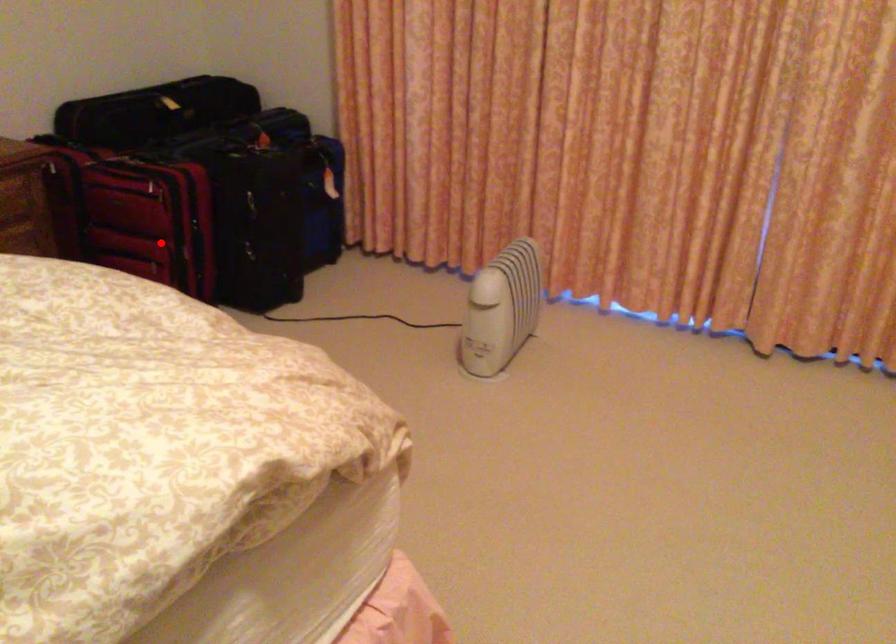
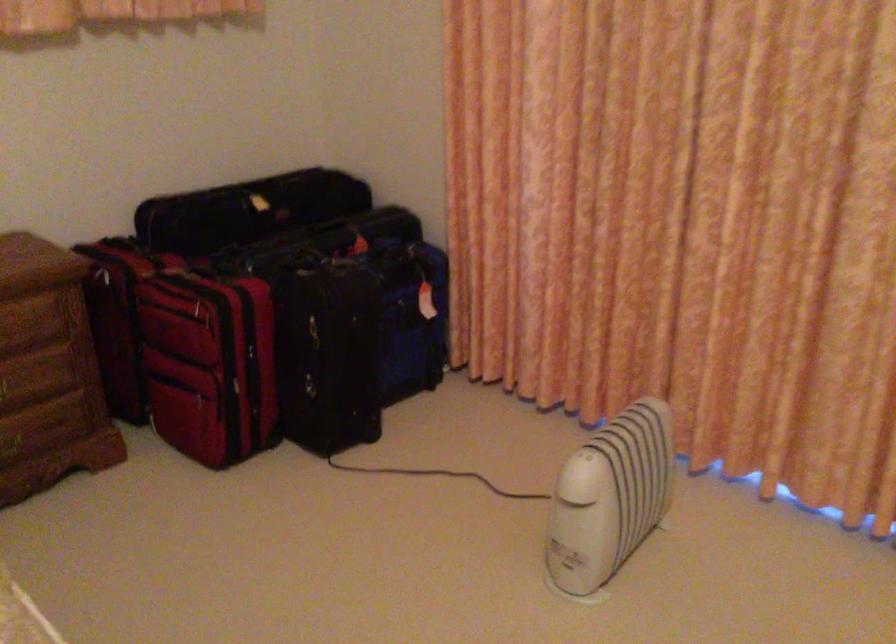
Question: I am providing you with two images of the same scene from different viewpoints. A red point is shown in image1. For the corresponding object point in image2, is it positioned nearer or farther from the camera?

Choices:
 (A) Nearer
 (B) Farther

Answer: (A)